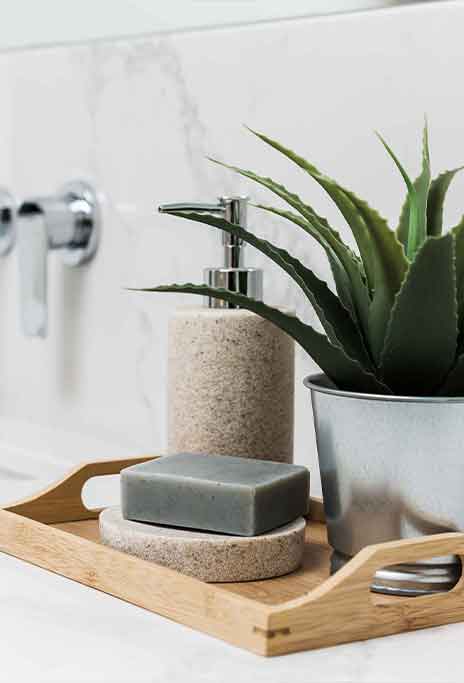
Find the location of `white wall`. white wall is located at coordinates (91, 20).